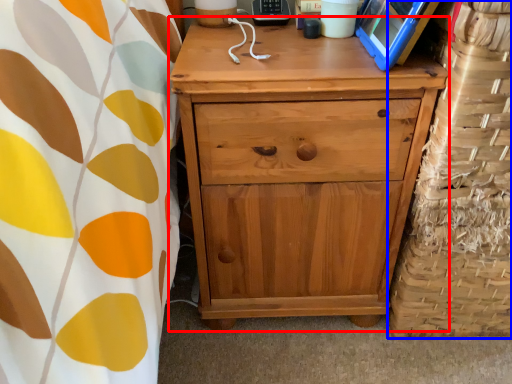
Question: Which point is closer to the camera, chest of drawers (highlighted by a red box) or basket (highlighted by a blue box)?

Choices:
 (A) chest of drawers
 (B) basket

Answer: (B)